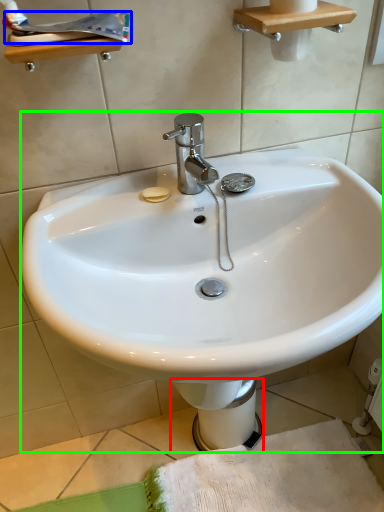
Question: Which object is the closest to the bidet (highlighted by a red box)? Choose among these: toothpaste (highlighted by a blue box) or sink (highlighted by a green box).

Choices:
 (A) toothpaste
 (B) sink

Answer: (B)